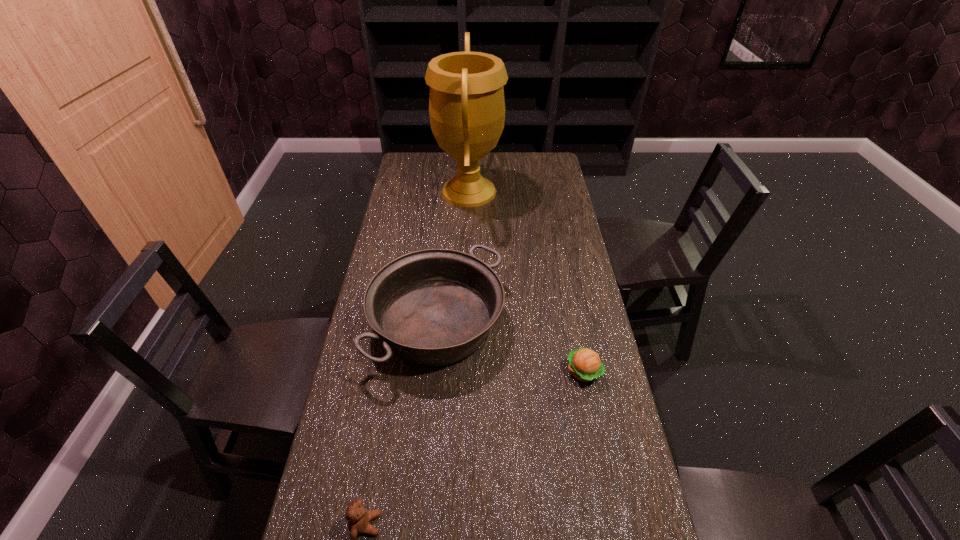
The image size is (960, 540). I want to click on trophy, so click(466, 104).

This screenshot has height=540, width=960. Find the location of `the tallest object`. the tallest object is located at coordinates (466, 104).

I want to click on the third shortest object, so click(x=435, y=307).

Where is `the shortest object`? the shortest object is located at coordinates point(585,365).

Locate an element on the screen. the rightmost object is located at coordinates (585, 365).

The image size is (960, 540). What are the coordinates of `free point located on the engravings side of the tallest object` in the screenshot? It's located at (526, 191).

This screenshot has width=960, height=540. I want to click on vacant space located on the back of the second tallest object, so click(444, 241).

Locate an element on the screen. The height and width of the screenshot is (540, 960). vacant space located on the left of the shortest object is located at coordinates (462, 372).

At what (x,y) coordinates should I click in order to perform the action: click on object situated at the far edge. Please return your answer as a coordinate pair (x, y). This screenshot has height=540, width=960. Looking at the image, I should click on (466, 104).

The height and width of the screenshot is (540, 960). Identify the location of object that is at the left edge. (435, 307).